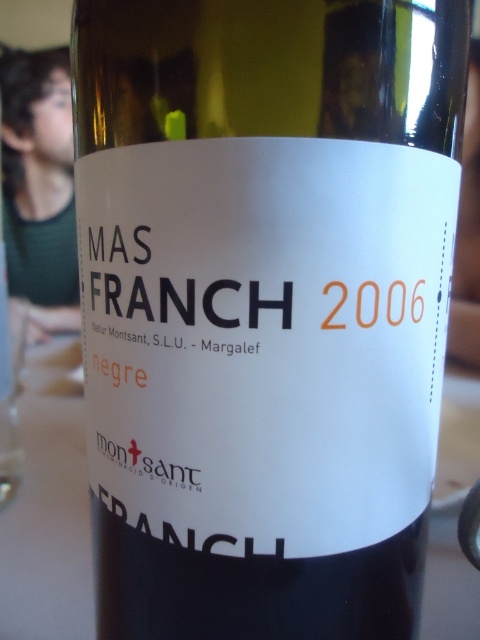
Who is more forward, (67, 369) or (23, 196)?

Point (67, 369) is more forward.

Is white paper label at center closer to camera compared to green knitted sweater at left?

Yes, white paper label at center is in front of green knitted sweater at left.

Between point (34, 525) and point (36, 163), which one is positioned behind?

The point (36, 163) is more distant.

Where is `white paper label at center`? This screenshot has width=480, height=640. white paper label at center is located at coordinates (48, 508).